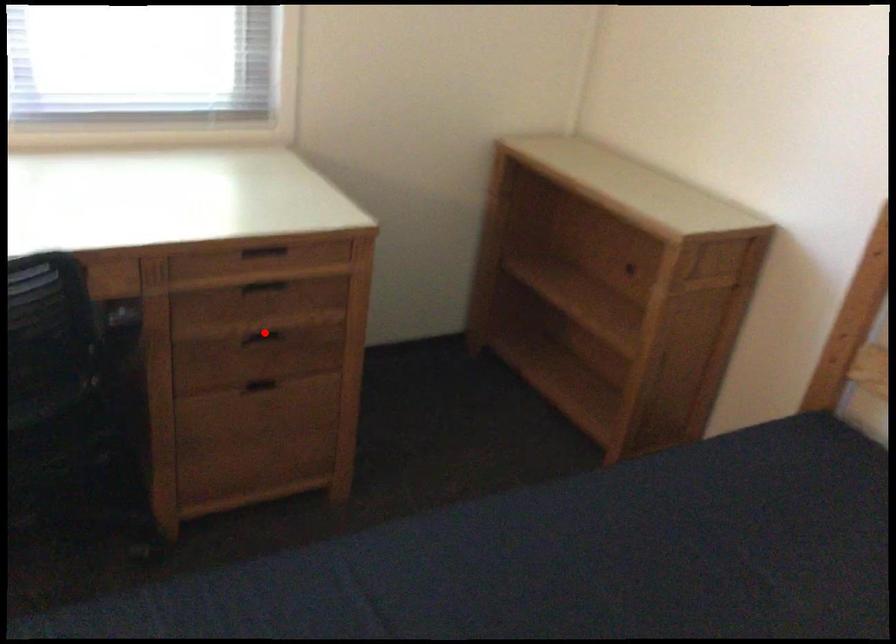
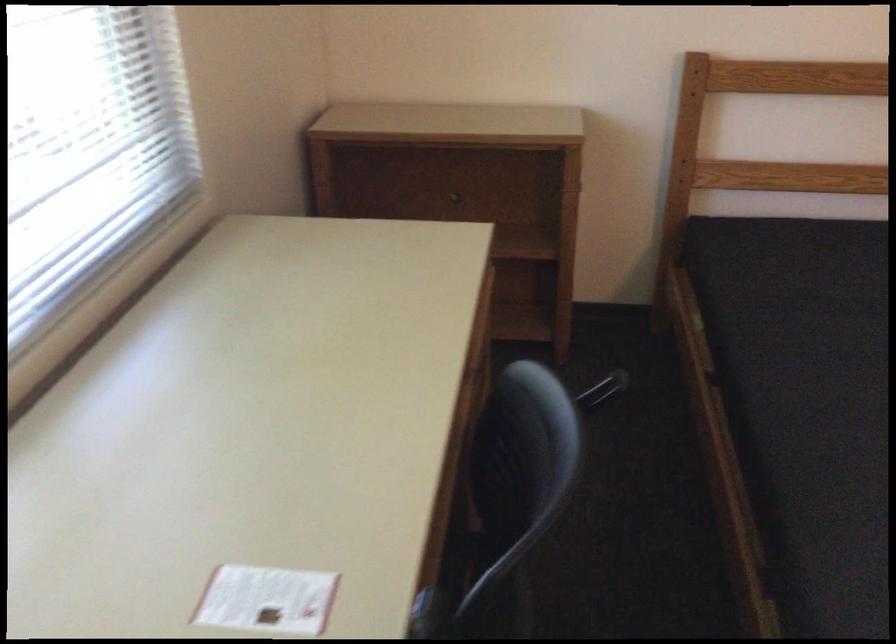
Question: I am providing you with two images of the same scene from different viewpoints. A red point is marked on the first image. Can you still see the location of the red point in image 2?

Choices:
 (A) Yes
 (B) No

Answer: (B)